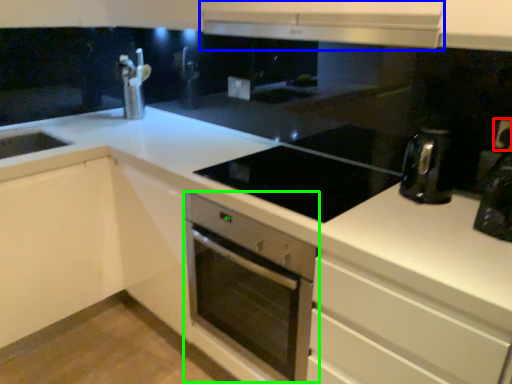
Question: Which is nearer to the electric outlet (highlighted by a red box)? exhaust hood (highlighted by a blue box) or home appliance (highlighted by a green box).

Choices:
 (A) exhaust hood
 (B) home appliance

Answer: (A)